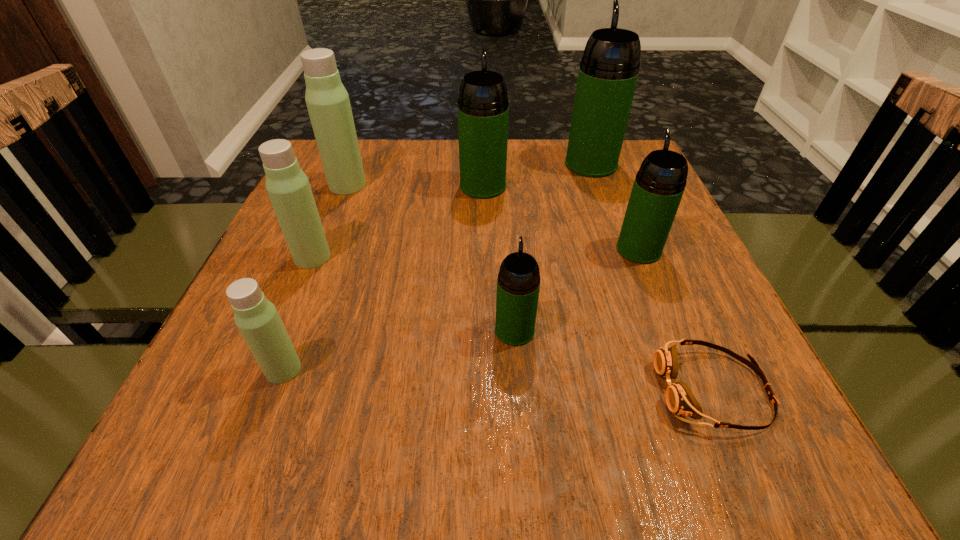
Locate an element on the screen. The height and width of the screenshot is (540, 960). vacant region at the near right corner is located at coordinates (733, 475).

This screenshot has height=540, width=960. I want to click on vacant space that is in between the third smallest green thermos bottle and the second smallest green thermos bottle, so click(561, 218).

Identify the location of vacant region between the smallest green thermos bottle and the third biggest green thermos bottle. (577, 290).

At what (x,y) coordinates should I click in order to perform the action: click on vacant area that lies between the biggest green thermos bottle and the shortest object. Please return your answer as a coordinate pair (x, y). Image resolution: width=960 pixels, height=540 pixels. Looking at the image, I should click on (652, 277).

Find the location of a particular element. The width and height of the screenshot is (960, 540). vacant area between the biggest light thermos bottle and the smallest light thermos bottle is located at coordinates point(316,277).

The image size is (960, 540). What are the coordinates of `free space between the shortest object and the smallest light thermos bottle` in the screenshot? It's located at (498, 380).

Image resolution: width=960 pixels, height=540 pixels. I want to click on vacant space that is in between the smallest green thermos bottle and the farthest light thermos bottle, so click(x=431, y=258).

Find the location of a particular element. This screenshot has width=960, height=540. unoccupied position between the goggles and the second smallest green thermos bottle is located at coordinates (676, 320).

This screenshot has height=540, width=960. Identify the location of empty space between the third farthest green thermos bottle and the nearest thermos bottle. (461, 309).

Image resolution: width=960 pixels, height=540 pixels. I want to click on vacant point located between the tallest thermos bottle and the second biggest green thermos bottle, so click(x=537, y=175).